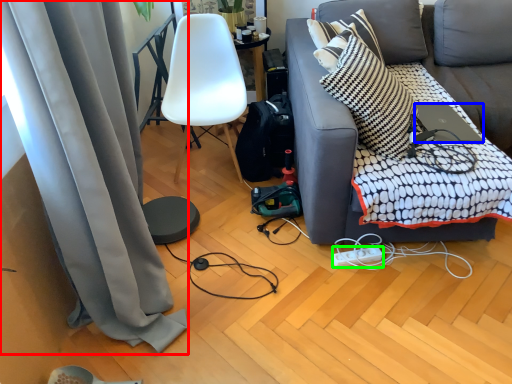
Question: Which object is positioned farthest from curtain (highlighted by a red box)? Select from laptop (highlighted by a blue box) and power outlet (highlighted by a green box).

Choices:
 (A) laptop
 (B) power outlet

Answer: (A)